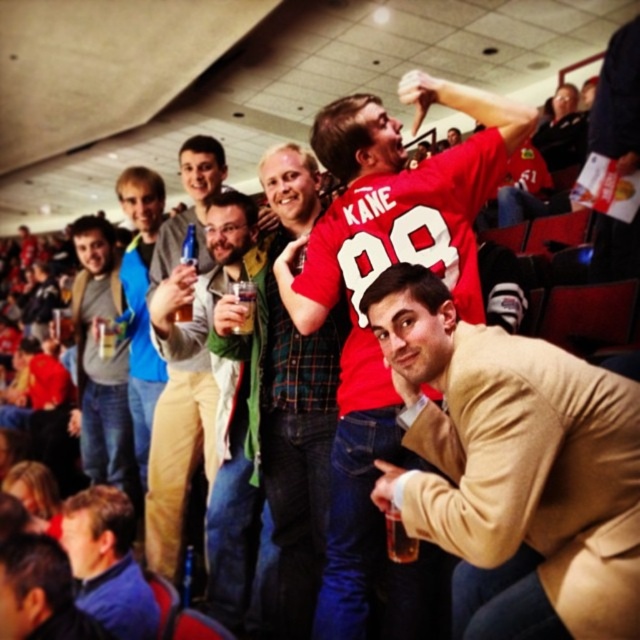
Is tan sweater at center to the right of dark brown leather jacket at lower left from the viewer's perspective?

Indeed, tan sweater at center is positioned on the right side of dark brown leather jacket at lower left.

Does tan sweater at center come behind dark brown leather jacket at lower left?

No, it is in front of dark brown leather jacket at lower left.

Is point (401, 298) in front of point (61, 608)?

Yes, point (401, 298) is closer to viewer.

Identify the location of tan sweater at center. (513, 468).

Is blue fabric jacket at lower left bigger than dark brown leather jacket at lower left?

Yes.

Who is more distant from viewer, [96,529] or [54,557]?

Positioned behind is point [96,529].

Locate an element on the screen. blue fabric jacket at lower left is located at coordinates (108, 563).

Looking at this image, does green plaid shirt at center have a smaller size compared to clear plastic cup at center?

Incorrect, green plaid shirt at center is not smaller in size than clear plastic cup at center.

Is point (278, 570) positioned behind point (250, 308)?

That is True.

Locate an element on the screen. green plaid shirt at center is located at coordinates (x=289, y=394).